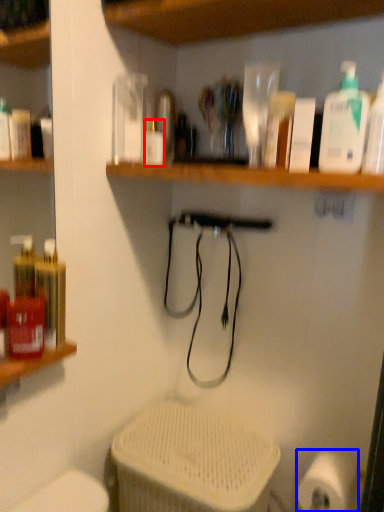
Question: Which object appears closest to the camera in this image, bottle (highlighted by a red box) or toilet paper (highlighted by a blue box)?

Choices:
 (A) bottle
 (B) toilet paper

Answer: (B)